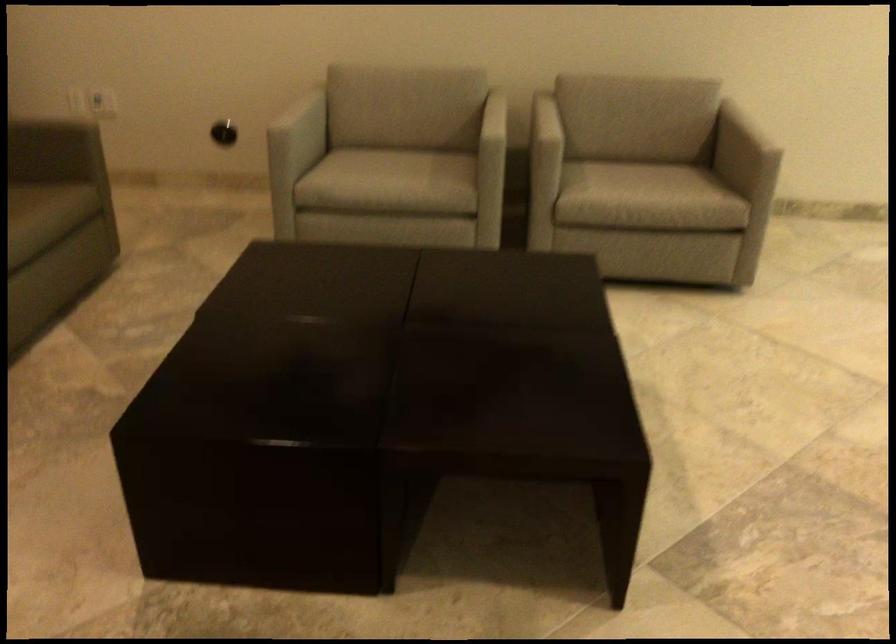
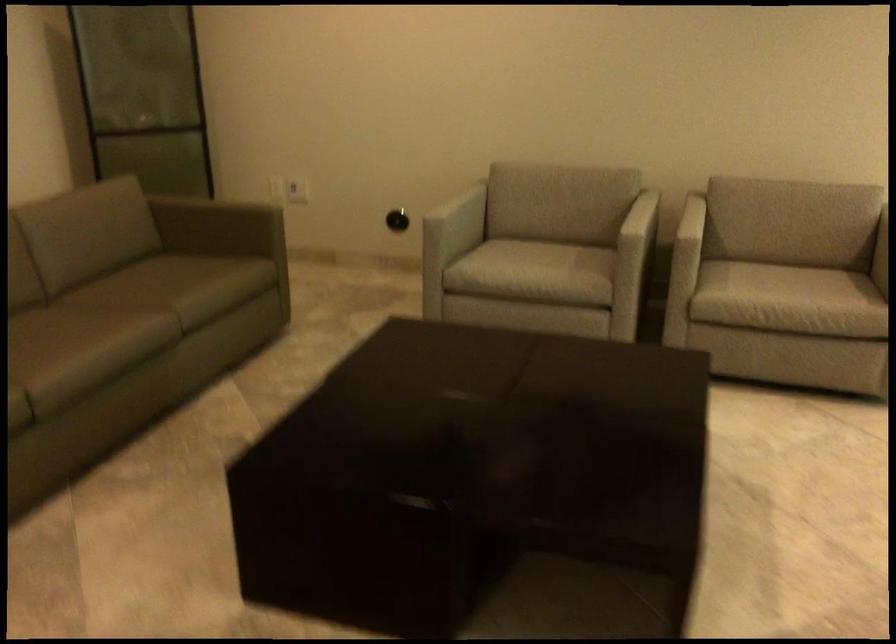
In a continuous first-person perspective shot, in which direction is the camera moving?

The cameraman walked toward right, backward.